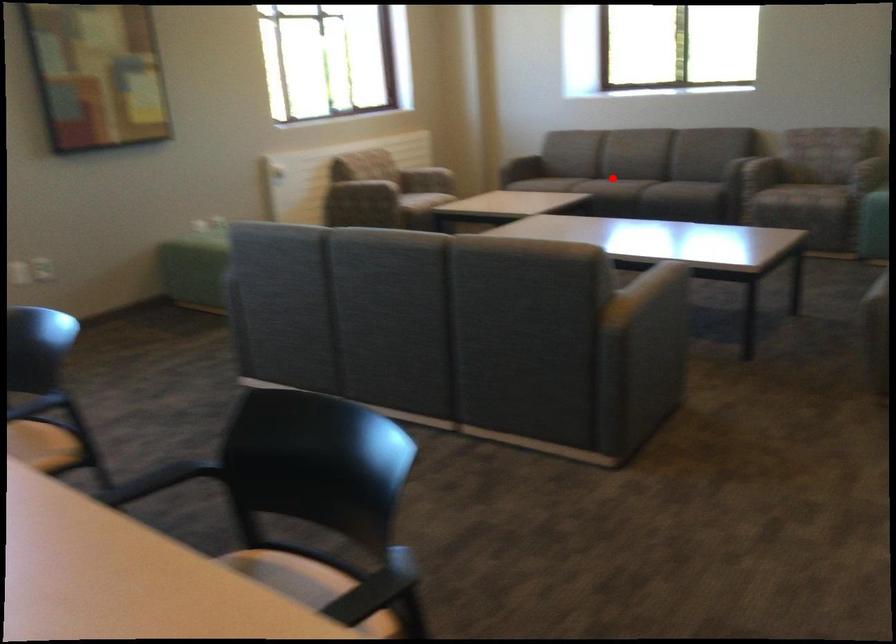
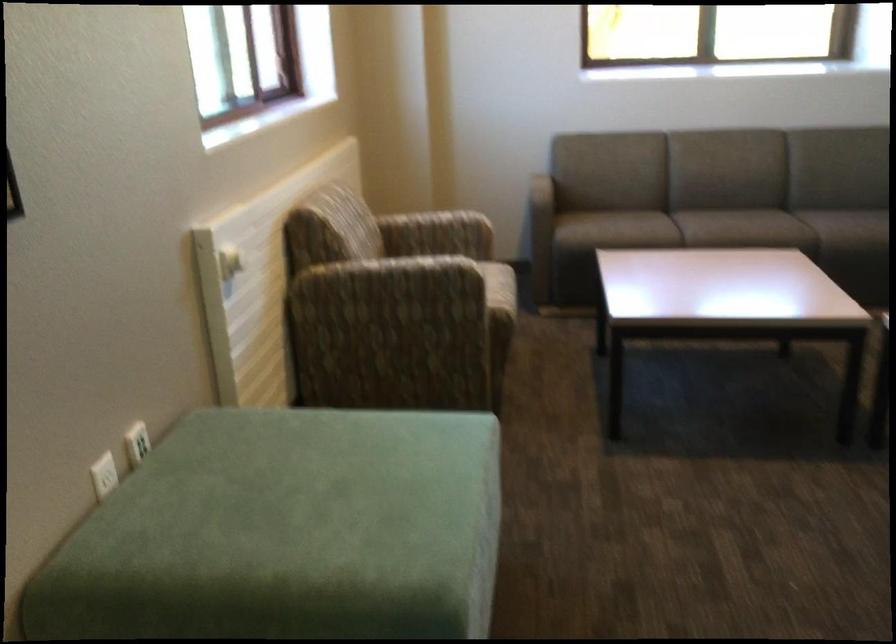
Question: I am providing you with two images of the same scene from different viewpoints. In image1, a red point is highlighted. Considering the same 3D point in image2, which of the following is correct?

Choices:
 (A) It is closer
 (B) It is farther

Answer: (A)